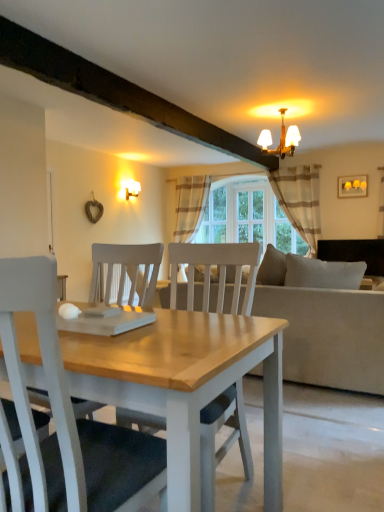
Question: Considering the relative positions of clear glass door at center and matte yellow picture frame at upper right in the image provided, is clear glass door at center to the right of matte yellow picture frame at upper right from the viewer's perspective?

Choices:
 (A) yes
 (B) no

Answer: (B)

Question: From the image's perspective, is clear glass door at center over matte yellow picture frame at upper right?

Choices:
 (A) no
 (B) yes

Answer: (A)

Question: From a real-world perspective, is clear glass door at center physically above matte yellow picture frame at upper right?

Choices:
 (A) no
 (B) yes

Answer: (A)

Question: Considering the relative sizes of clear glass door at center and matte yellow picture frame at upper right in the image provided, is clear glass door at center bigger than matte yellow picture frame at upper right?

Choices:
 (A) no
 (B) yes

Answer: (B)

Question: Considering the relative sizes of clear glass door at center and matte yellow picture frame at upper right in the image provided, is clear glass door at center shorter than matte yellow picture frame at upper right?

Choices:
 (A) yes
 (B) no

Answer: (B)

Question: Is clear glass door at center further to the viewer compared to matte yellow picture frame at upper right?

Choices:
 (A) yes
 (B) no

Answer: (A)

Question: Is beige striped fabric curtain at upper right, placed as the 2th curtain when sorted from back to front, shorter than matte yellow picture frame at upper right?

Choices:
 (A) yes
 (B) no

Answer: (B)

Question: Is beige striped fabric curtain at upper right, the second curtain in the left-to-right sequence, beside matte yellow picture frame at upper right?

Choices:
 (A) yes
 (B) no

Answer: (B)

Question: Is beige striped fabric curtain at upper right, the second curtain in the left-to-right sequence, in front of matte yellow picture frame at upper right?

Choices:
 (A) yes
 (B) no

Answer: (B)

Question: From a real-world perspective, does beige striped fabric curtain at upper right, placed as the 2th curtain when sorted from back to front, stand above matte yellow picture frame at upper right?

Choices:
 (A) no
 (B) yes

Answer: (A)

Question: From the image's perspective, does beige striped fabric curtain at upper right, which is the first curtain in right-to-left order, appear higher than matte yellow picture frame at upper right?

Choices:
 (A) no
 (B) yes

Answer: (A)

Question: Does beige striped fabric curtain at upper right, the second curtain in the left-to-right sequence, appear on the left side of matte yellow picture frame at upper right?

Choices:
 (A) no
 (B) yes

Answer: (B)

Question: Is matte white wall sconce at upper left, the second lamp from the front, closer to the viewer compared to clear glass door at center?

Choices:
 (A) no
 (B) yes

Answer: (B)